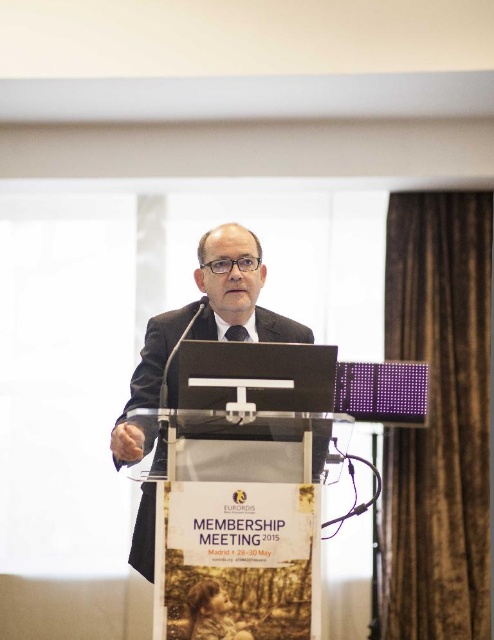
Is matte black suit at center to the right of black textured tie at center from the viewer's perspective?

Incorrect, matte black suit at center is not on the right side of black textured tie at center.

What do you see at coordinates (203, 326) in the screenshot? I see `matte black suit at center` at bounding box center [203, 326].

Where is `matte black suit at center`? This screenshot has height=640, width=494. matte black suit at center is located at coordinates (203, 326).